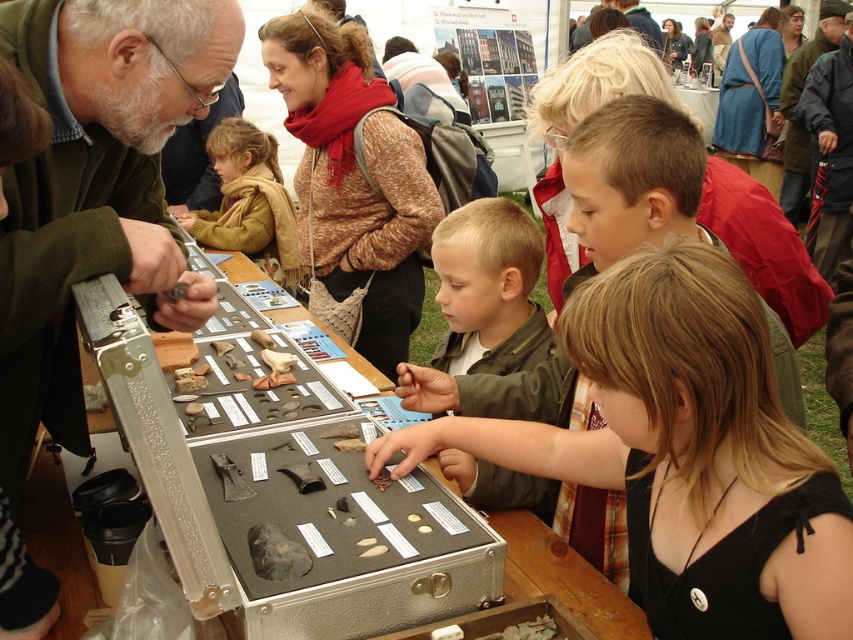
Question: Estimate the real-world distances between objects in this image. Which object is closer to the green matte jacket at upper left?

Choices:
 (A) brown woolen scarf at upper center
 (B) blonde hair at center
 (C) brown fuzzy jacket at upper left
 (D) green matte jacket at center

Answer: (B)

Question: Which of the following is the closest to the observer?

Choices:
 (A) (224, 224)
 (B) (62, 378)

Answer: (B)

Question: Can you confirm if blonde hair at center is smaller than brown woolen scarf at upper center?

Choices:
 (A) yes
 (B) no

Answer: (A)

Question: From the image, what is the correct spatial relationship of green matte jacket at center in relation to brown woolen scarf at upper center?

Choices:
 (A) left
 (B) right

Answer: (A)

Question: Which point is closer to the camera?

Choices:
 (A) (500, 396)
 (B) (500, 337)
 (C) (241, 196)

Answer: (A)

Question: Can you confirm if blonde hair at center is wider than brown fuzzy jacket at upper left?

Choices:
 (A) no
 (B) yes

Answer: (A)